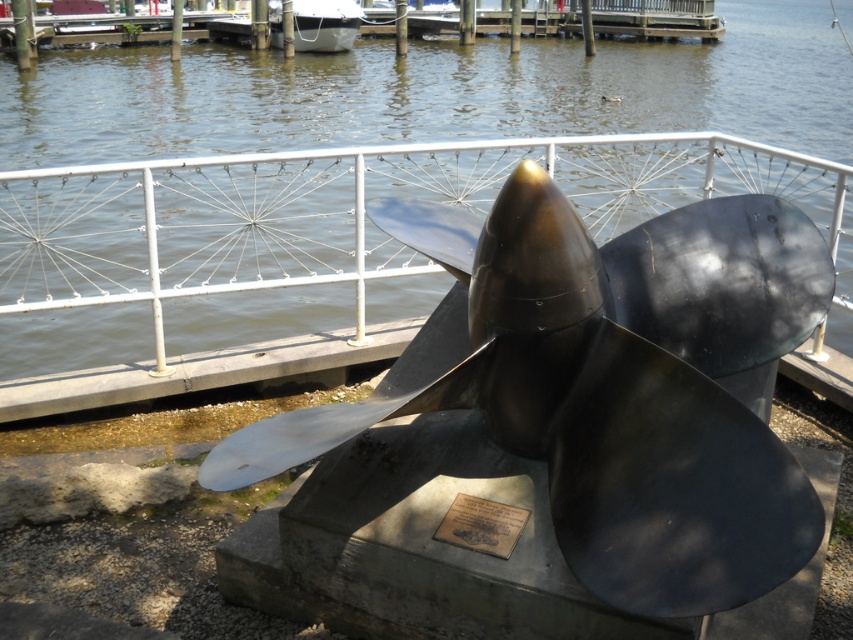
You are a maintenance worker inspecting the propeller sculpture. You need to determine if the bronze plaque at center is visible above the metallic water at center. Based on the scene, can you confirm this?

The metallic water at center has a greater height compared to bronze plaque at center, meaning the plaque is partially or fully submerged, so it might not be visible above the water.

You are standing in front of the propeller sculpture and want to read the bronze plaque at center. Where should you look to find it?

The bronze plaque at center is located at point coordinates of (480, 525). So you should look at the coordinates (480, 525) to find it.